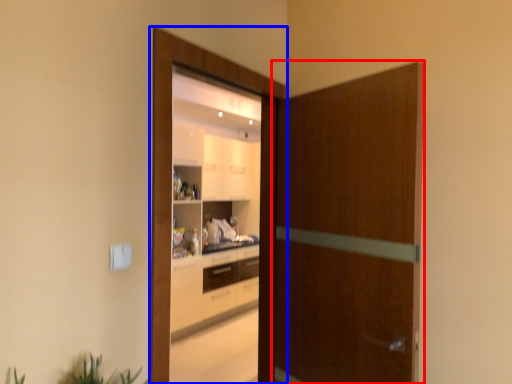
Question: Among these objects, which one is farthest to the camera, screen door (highlighted by a red box) or screen door (highlighted by a blue box)?

Choices:
 (A) screen door
 (B) screen door

Answer: (B)